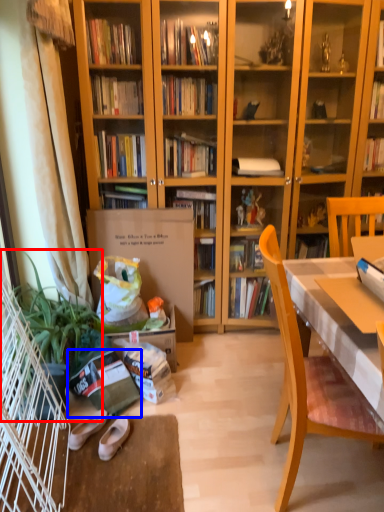
Question: Which point is closer to the camera, houseplant (highlighted by a red box) or paperback book (highlighted by a blue box)?

Choices:
 (A) houseplant
 (B) paperback book

Answer: (A)